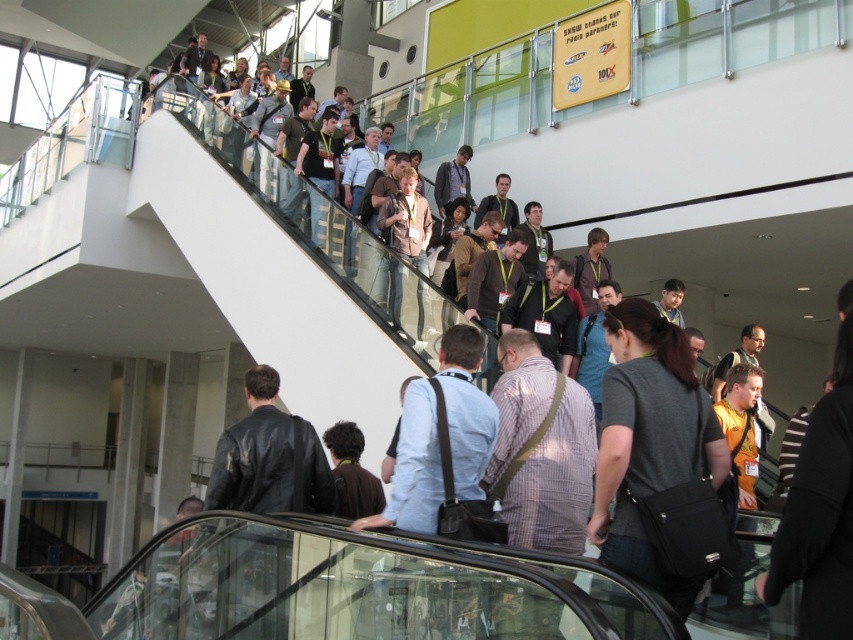
You are standing at the base of the staircase in the convention center and see two points marked on the staircase. The first point is at coordinate point (630, 332) and the second is at point (265, 371). Which point is closer to you?

Point (630, 332) is closer to the viewer than point (265, 371).

You are a photographer positioned at the camera location. You want to capture a closeup shot of the dark gray fabric shirt at center. Given that your camera has a minimum focusing distance of 2 meters, will you be able to take the photo without moving closer?

The dark gray fabric shirt at center is 4.82 meters away from the camera. Since the minimum focusing distance is 2 meters, the photographer can take the closeup shot without moving closer because the subject is beyond the minimum required distance.

You are a photographer positioned at the base of the staircase. You want to capture a candid shot of the dark gray fabric shirt at center and the leather jacket at center. Since the two subjects are at the same position, which clothing item would appear more slender in the photo?

The dark gray fabric shirt at center is thinner than the leather jacket at center, so it would appear more slender in the photo.